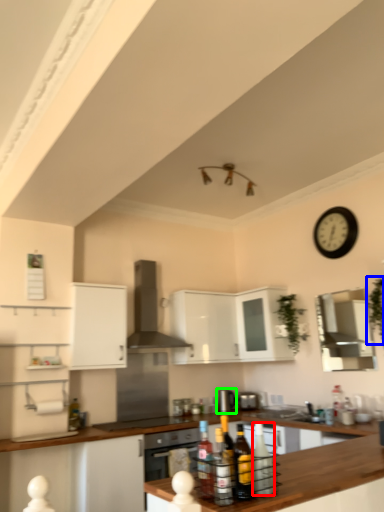
Question: Which is nearer to the bottle (highlighted by a red box)? plant (highlighted by a blue box) or appliance (highlighted by a green box).

Choices:
 (A) plant
 (B) appliance

Answer: (A)